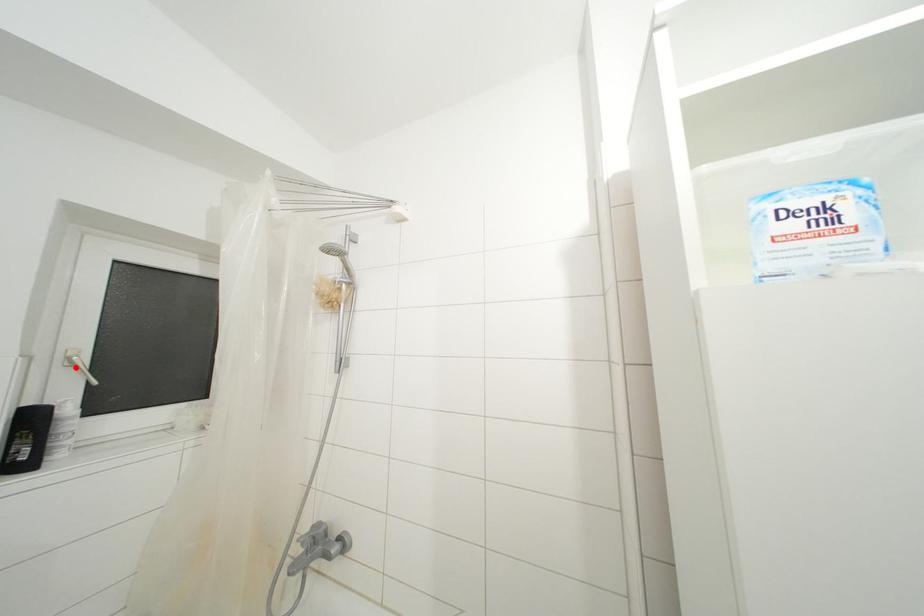
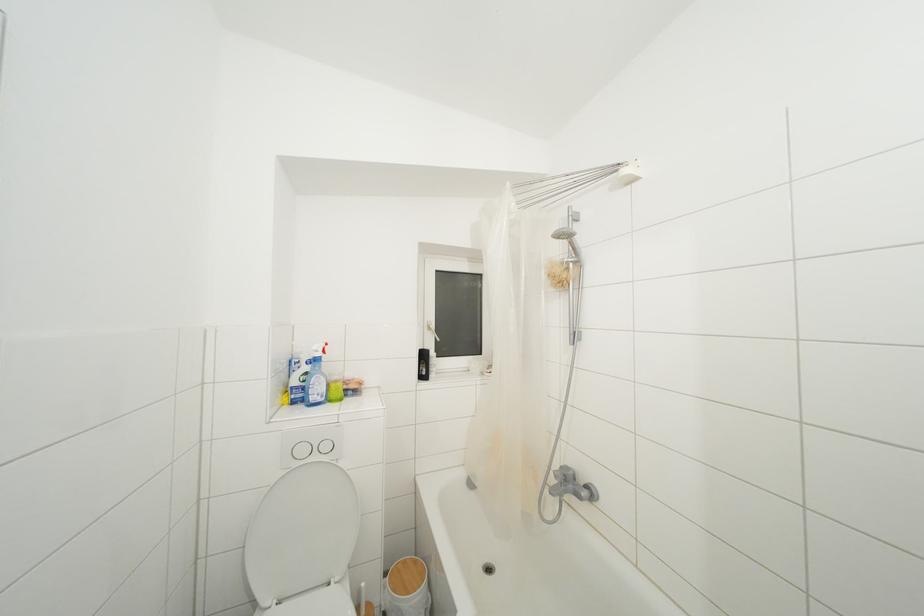
Where in the second image is the point corresponding to the highlighted location from the first image?

(433, 333)